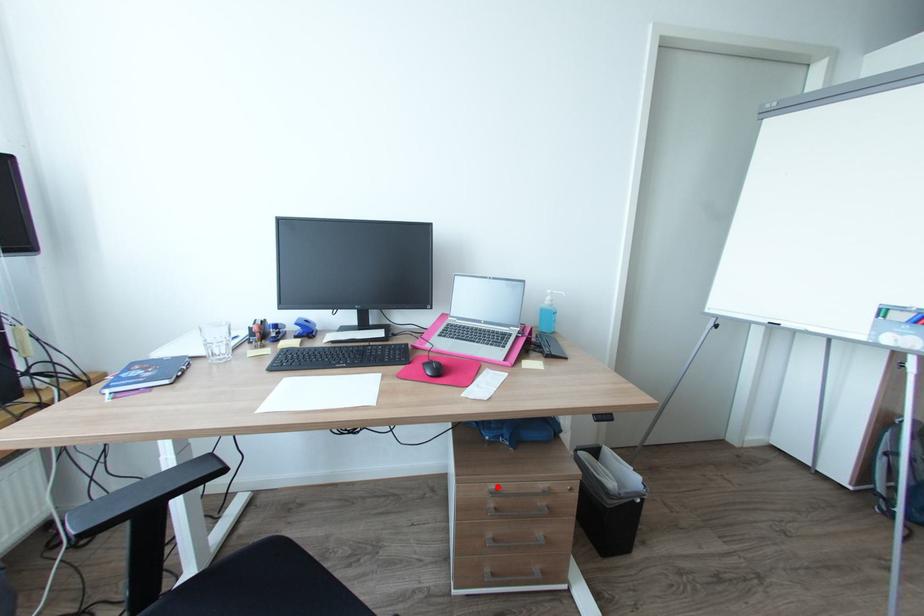
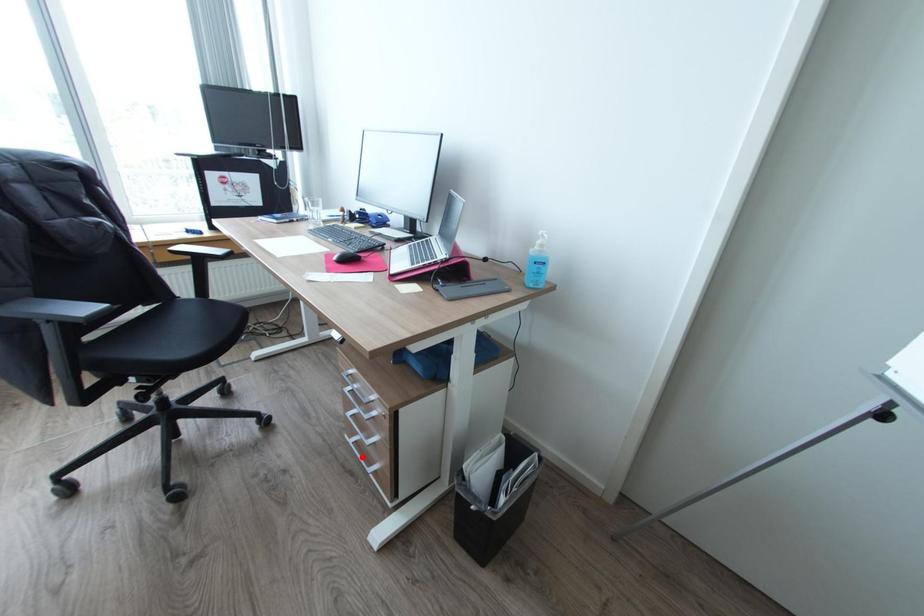
I am providing you with two images of the same scene from different viewpoints. A red point is marked on the first image and another point is marked on the second image. Are the points marked in image1 and image2 representing the same 3D position?

No